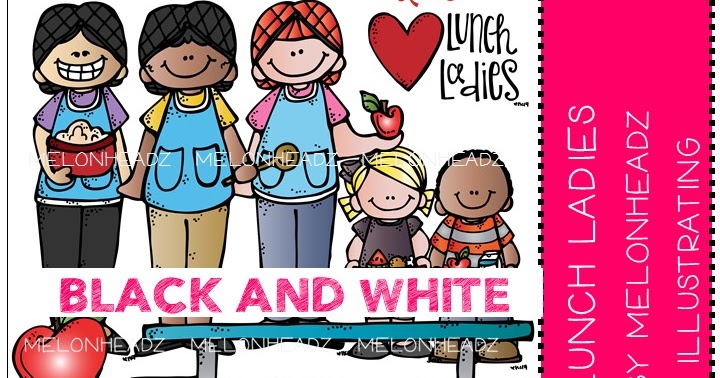
Where is `bench`? bench is located at coordinates (268, 333), (464, 364), (438, 328), (202, 363).